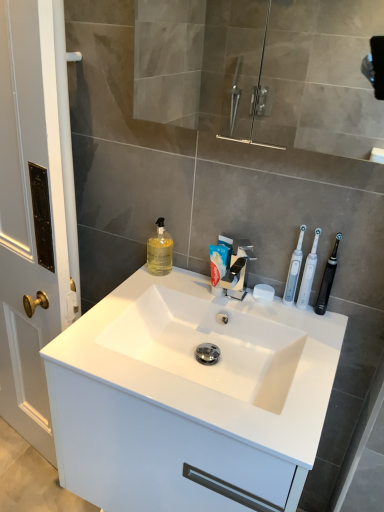
At what (x,y) coordinates should I click in order to perform the action: click on vacant region in front of translucent yellow liquid at sink left. Please return your answer as a coordinate pair (x, y). The image size is (384, 512). Looking at the image, I should click on (141, 291).